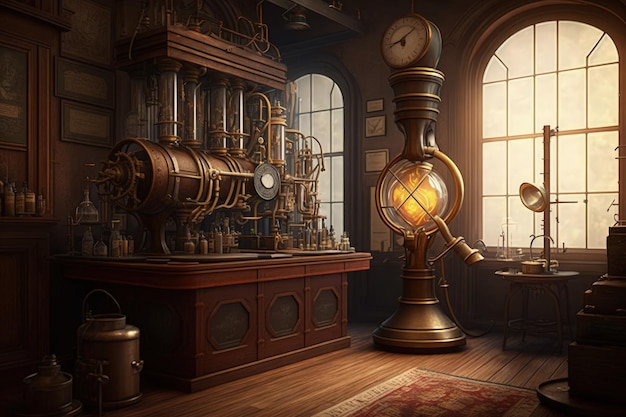
Locate an element on the screen. This screenshot has height=417, width=626. window is located at coordinates (510, 111), (332, 116).